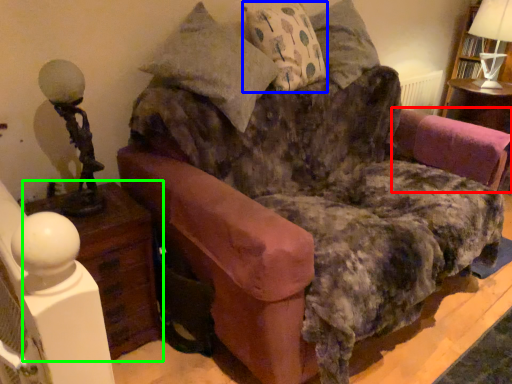
Question: Estimate the real-world distances between objects in this image. Which object is farther from swivel chair (highlighted by a red box), pillow (highlighted by a blue box) or nightstand (highlighted by a green box)?

Choices:
 (A) pillow
 (B) nightstand

Answer: (B)